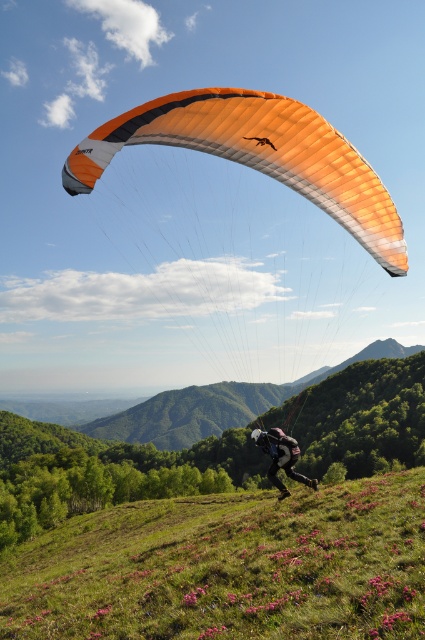
Who is positioned more to the left, orange fabric parachute at upper center or black fabric parachute at center?

orange fabric parachute at upper center

Is orange fabric parachute at upper center positioned at the back of black fabric parachute at center?

No, it is not.

The height and width of the screenshot is (640, 425). Describe the element at coordinates (257, 156) in the screenshot. I see `orange fabric parachute at upper center` at that location.

Locate an element on the screen. orange fabric parachute at upper center is located at coordinates (257, 156).

Which is in front, point (312, 566) or point (399, 240)?

Point (312, 566) is in front.

Is point (218, 628) positioned in front of point (362, 234)?

Yes, point (218, 628) is in front of point (362, 234).

Where is `green grassy hillside at lower center`? This screenshot has width=425, height=640. green grassy hillside at lower center is located at coordinates (229, 566).

Can you confirm if green grassy hillside at lower center is bigger than black fabric parachute at center?

Yes.

Which of these two, green grassy hillside at lower center or black fabric parachute at center, stands taller?

green grassy hillside at lower center

Who is more forward, (19, 573) or (291, 458)?

Point (291, 458) is in front.

This screenshot has height=640, width=425. I want to click on green grassy hillside at lower center, so point(229,566).